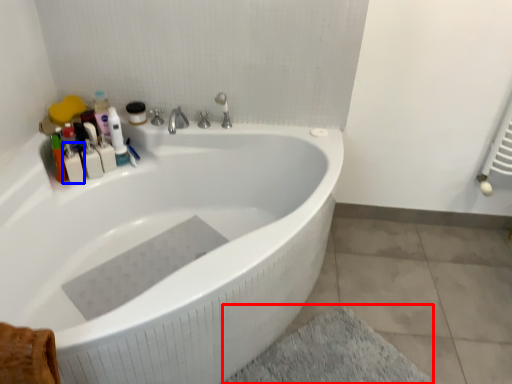
Question: Which of the following is the closest to the observer, bath mat (highlighted by a red box) or toiletry (highlighted by a blue box)?

Choices:
 (A) bath mat
 (B) toiletry

Answer: (A)